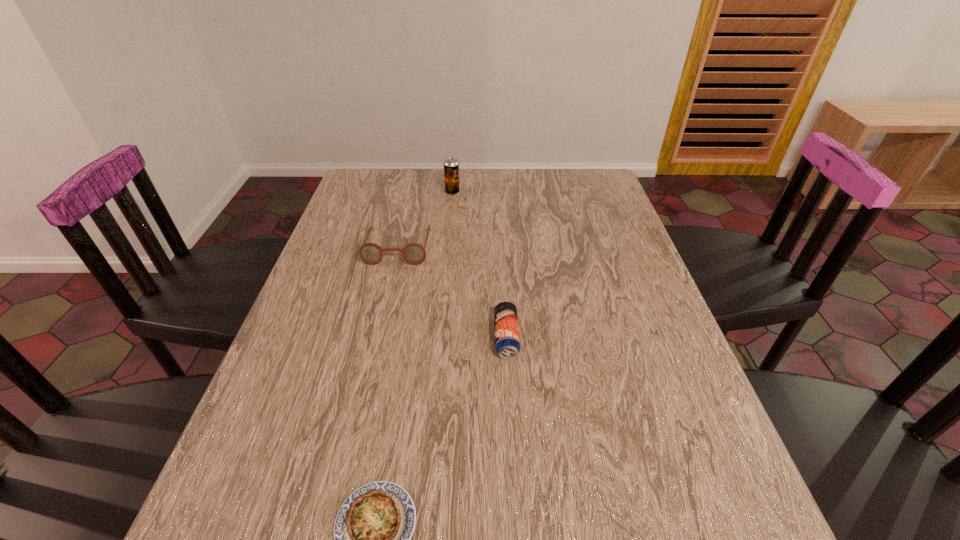
What are the coordinates of `object that is at the left edge` in the screenshot? It's located at (370, 253).

At what (x,y) coordinates should I click in order to perform the action: click on free region at the far edge. Please return your answer as a coordinate pair (x, y). This screenshot has width=960, height=540. Looking at the image, I should click on (471, 180).

In the image, there is a desktop. At what (x,y) coordinates should I click in order to perform the action: click on free space at the near edge. Please return your answer as a coordinate pair (x, y). Looking at the image, I should click on (549, 527).

This screenshot has height=540, width=960. In the image, there is a desktop. In order to click on free space at the left edge in this screenshot , I will do `click(289, 477)`.

I want to click on vacant space at the right edge of the desktop, so click(x=623, y=315).

Where is `free space at the far right corner of the desktop`? free space at the far right corner of the desktop is located at coordinates (583, 177).

At what (x,y) coordinates should I click in order to perform the action: click on vacant area that lies between the left beer can and the third farthest object. Please return your answer as a coordinate pair (x, y). The width and height of the screenshot is (960, 540). Looking at the image, I should click on (479, 265).

This screenshot has width=960, height=540. Find the location of `vacant region between the third shortest object and the taller beer can`. vacant region between the third shortest object and the taller beer can is located at coordinates (425, 219).

The height and width of the screenshot is (540, 960). I want to click on free area in between the nearer beer can and the spectacles, so click(x=452, y=292).

I want to click on vacant area that lies between the second nearest object and the third shortest object, so click(x=452, y=292).